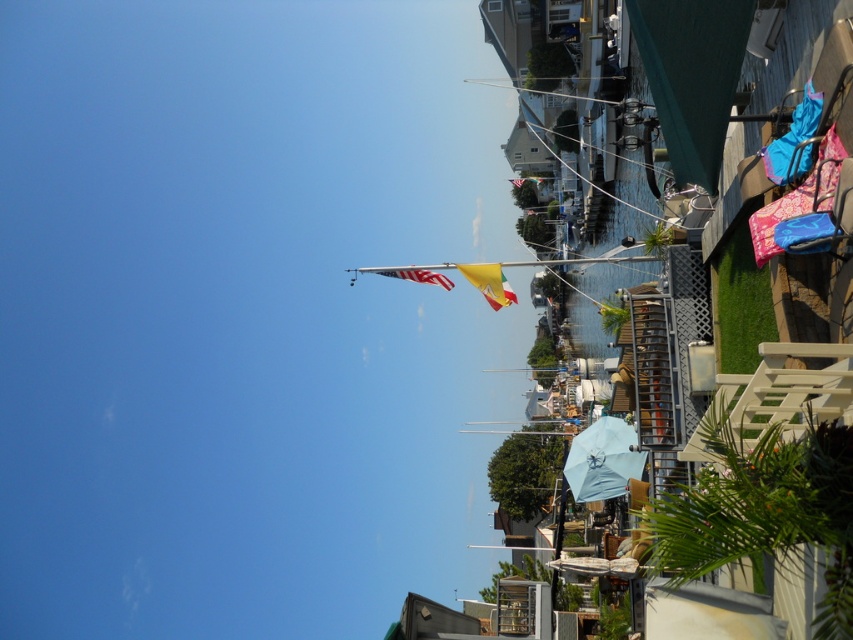
You are standing at the dockside and want to take a photo of the waterfront scene. You notice two points marked in the image. Which point, point (596, 474) or point (403, 275), is closer to your camera position?

Point (403, 275) is closer to the camera position because it is less further than point (596, 474).

You are planning to set up a small picnic area between the light blue fabric umbrella at center and the yellow fabric flag at center. The picnic blanket you have is 25 feet long. Will the blanket fit between them without overlapping either object?

The distance between the light blue fabric umbrella at center and the yellow fabric flag at center is 23.34 feet. Since the picnic blanket is 25 feet long, it will extend beyond the space between them by approximately 1.66 feet, so it will overlap both objects.